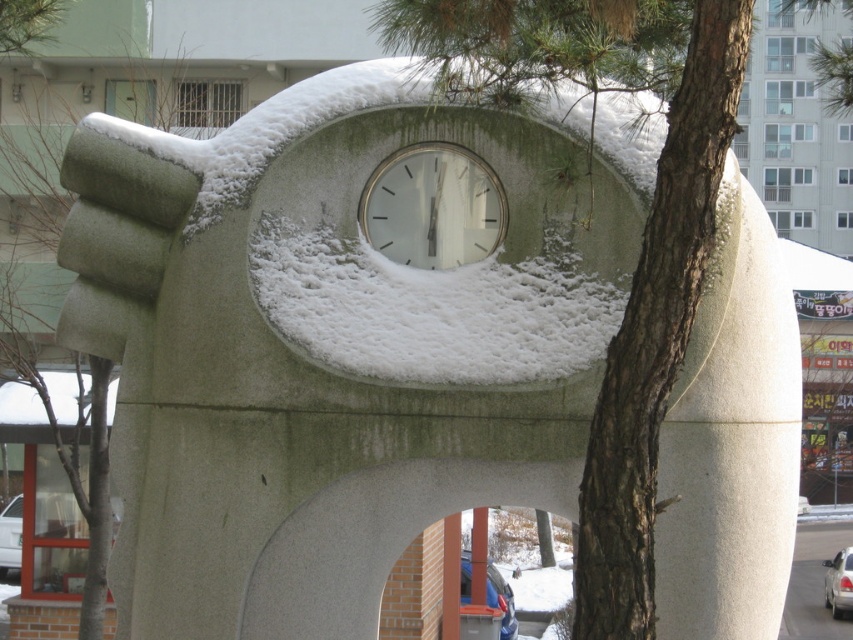
You are an architect designing a winter garden and want to place a small statue of a rabbit between the white fluffy snow at center and the brown rough bark at center. Which object should the statue be closer to if it needs to be placed near the smaller one?

The white fluffy snow at center is smaller than the brown rough bark at center, so the statue should be placed closer to the white fluffy snow at center.

You are standing in front of the architectural structure and want to touch the white fluffy snow at center and the white matte clock at center. Which object can you reach first without moving your position?

The white fluffy snow at center is closer to the viewer than the white matte clock at center, so you can reach the white fluffy snow at center first without moving your position.

You are an architect designing a new sculpture that needs to be placed between the brown rough bark at center and the metallic blue pole at center. If the sculpture must be shorter than both objects, which object should you use as the reference for the maximum height?

The sculpture must be shorter than both the brown rough bark at center and the metallic blue pole at center. Since the brown rough bark at center is shorter than the metallic blue pole at center, you should use the brown rough bark at center as the reference for the maximum height to ensure the sculpture is shorter than both.